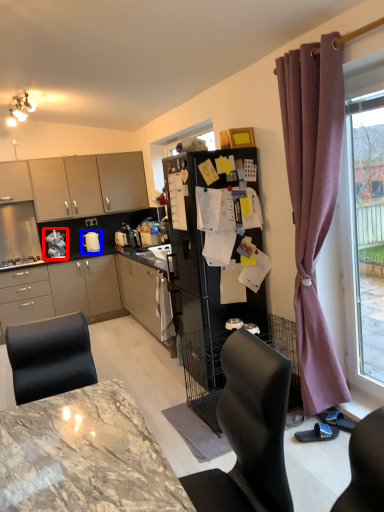
Question: Which object is further to the camera taking this photo, appliance (highlighted by a red box) or appliance (highlighted by a blue box)?

Choices:
 (A) appliance
 (B) appliance

Answer: (B)